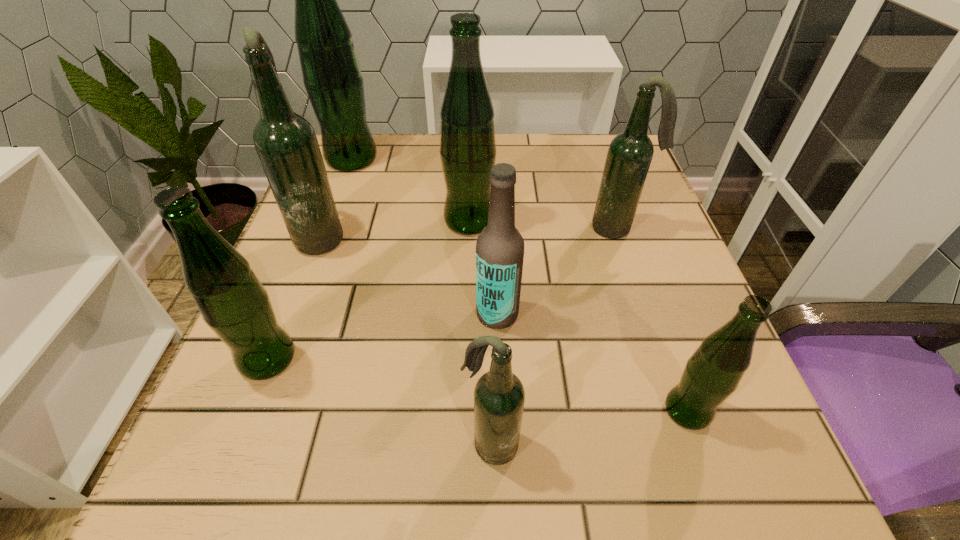
This screenshot has width=960, height=540. What are the coordinates of `free space between the second biggest green beer bottle and the rightmost green beer bottle` in the screenshot? It's located at (578, 316).

Identify the location of free space between the leftmost dark beer bottle and the third smallest green beer bottle. The height and width of the screenshot is (540, 960). (396, 228).

Select which object appears as the third closest to the sixth farthest beer bottle. Please provide its 2D coordinates. Your answer should be formatted as a tuple, i.e. [(x, y)], where the tuple contains the x and y coordinates of a point satisfying the conditions above.

[(500, 247)]

Where is `the third closest object relative to the third smallest green beer bottle`? This screenshot has width=960, height=540. the third closest object relative to the third smallest green beer bottle is located at coordinates (630, 153).

Where is `beer bottle that is the second closest to the smallest dark beer bottle`? This screenshot has width=960, height=540. beer bottle that is the second closest to the smallest dark beer bottle is located at coordinates (713, 372).

What are the coordinates of `the sixth closest beer bottle to the tallest beer bottle` in the screenshot? It's located at point(499,396).

Identify which green beer bottle is located as the nearest to the nearest green beer bottle. Please provide its 2D coordinates. Your answer should be formatted as a tuple, i.e. [(x, y)], where the tuple contains the x and y coordinates of a point satisfying the conditions above.

[(468, 149)]

At what (x,y) coordinates should I click in order to perform the action: click on green beer bottle that can be found as the third closest to the smallest dark beer bottle. Please return your answer as a coordinate pair (x, y). The image size is (960, 540). Looking at the image, I should click on (468, 149).

Identify which dark beer bottle is the nearest to the second nearest green beer bottle. Please provide its 2D coordinates. Your answer should be formatted as a tuple, i.e. [(x, y)], where the tuple contains the x and y coordinates of a point satisfying the conditions above.

[(286, 143)]

Choose which dark beer bottle is the nearest neighbor to the third smallest green beer bottle. Please provide its 2D coordinates. Your answer should be formatted as a tuple, i.e. [(x, y)], where the tuple contains the x and y coordinates of a point satisfying the conditions above.

[(286, 143)]